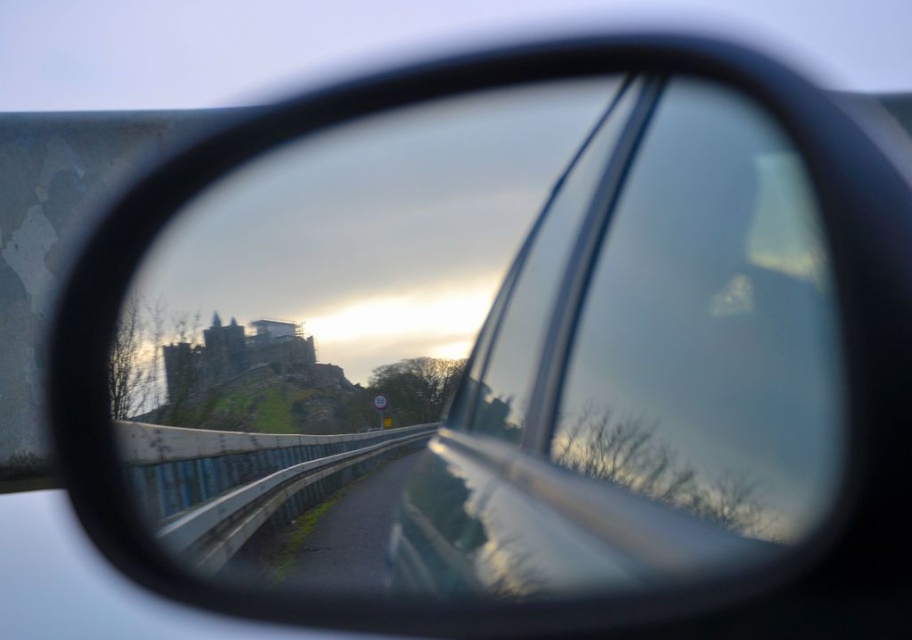
You are a driver checking your side mirror while approaching a historic castle on a hill. Your car has a glossy metallic mirror at center. Where is this mirror positioned relative to the road and guardrail?

The glossy metallic mirror at center is located at point (372, 344), which places it centrally positioned relative to the road and guardrail, providing a clear view of the surroundings as you approach the castle.

You are a passenger in the car and want to check the road ahead using the glossy metallic mirror at center and the metallic silver car window at center. Which object allows you to see the road ahead more clearly?

The glossy metallic mirror at center allows you to see the road ahead more clearly because mirrors are designed to reflect images, while windows primarily allow light to pass through without reflecting as much.

You are a driver checking your side mirror while approaching a hill with a castle. You notice the glossy metallic mirror at center and the metallic silver car window at center. Which object is taller from your viewpoint?

The glossy metallic mirror at center is taller than the metallic silver car window at center according to the description.